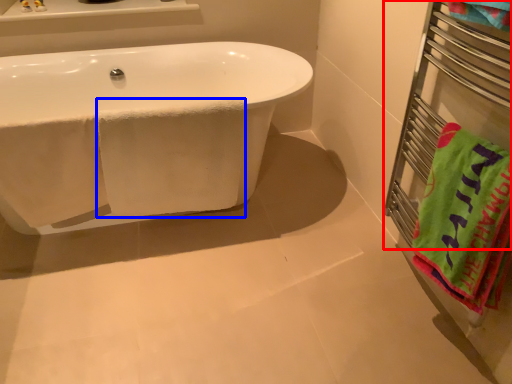
Question: Which of the following is the closest to the observer, balustrade (highlighted by a red box) or bath towel (highlighted by a blue box)?

Choices:
 (A) balustrade
 (B) bath towel

Answer: (A)